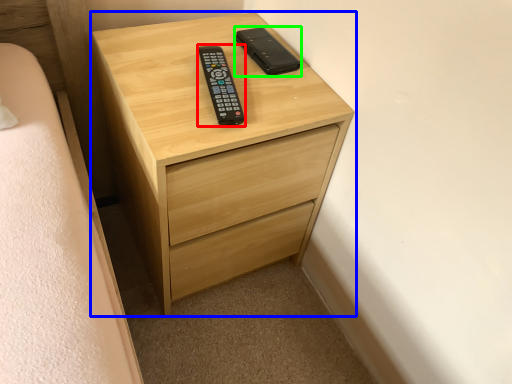
Question: Which object is the closest to the control (highlighted by a red box)? Choose among these: chest of drawers (highlighted by a blue box) or control (highlighted by a green box).

Choices:
 (A) chest of drawers
 (B) control

Answer: (B)